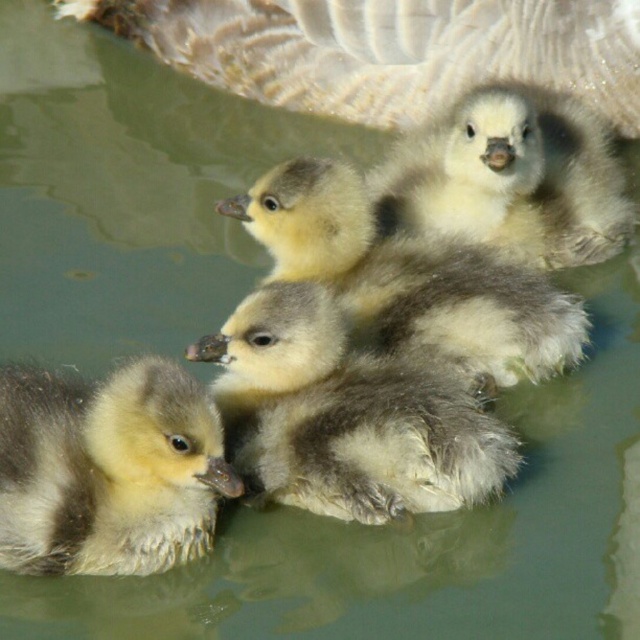
You are a photographer observing ducklings in a murky greenish water. You notice gray downy feathers at upper center and a soft gray downy duckling at center. Which object is taller?

The gray downy feathers at upper center has a lesser height compared to the soft gray downy duckling at center, so the soft gray downy duckling at center is taller.

Looking at this image, where is the soft gray downy duckling at center located in the image?

The soft gray downy duckling at center is located at point 0.652 on the x axis and 0.539 on the y axis.

You are a birdwatcher observing the ducklings in the water. You notice the soft gray downy duckling at center and the gray downy feathers at upper center. Which object is closer to you, the observer?

The gray downy feathers at upper center are closer to you because the soft gray downy duckling at center is behind them.